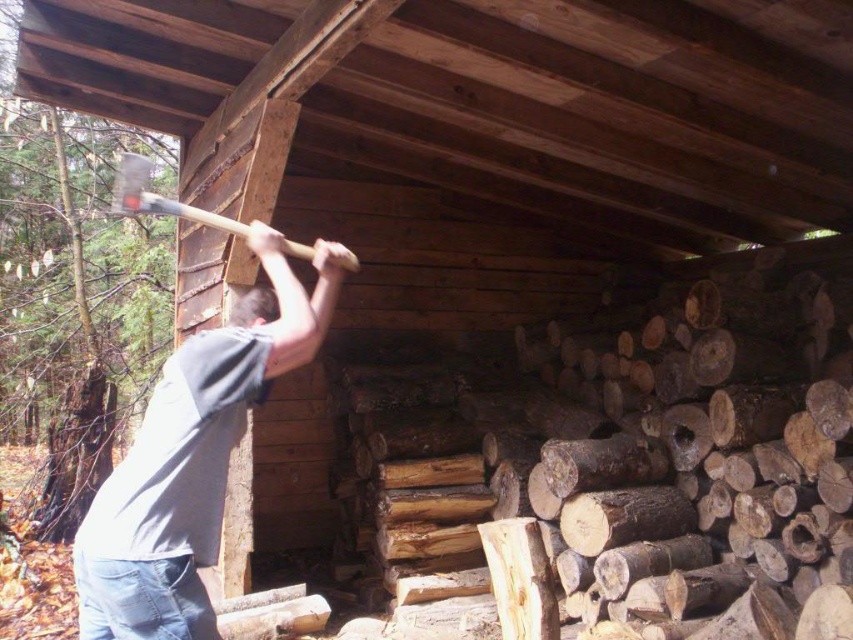
You are a carpenter who needs to choose between the matte wooden hammer at upper center and the dark brown hair at upper center to hang a picture frame. Which object is wider and more suitable for holding the nail?

The matte wooden hammer at upper center is wider than the dark brown hair at upper center, so it is more suitable for holding the nail.

You are a painter who wants to paint the scene. You need to know which object is taller between the gray cotton shirt at upper left and the matte wooden hammer at upper center to decide where to place shadows. Which one is taller?

The gray cotton shirt at upper left is taller than the matte wooden hammer at upper center, so the shadow should be placed accordingly based on its height.

You are observing a person inside a wooden shed chopping wood. You notice a matte wooden hammer at upper center and a dark brown hair at upper center. Which object is located to the left of the other?

Answer: The matte wooden hammer at upper center is positioned on the left side of dark brown hair at upper center.